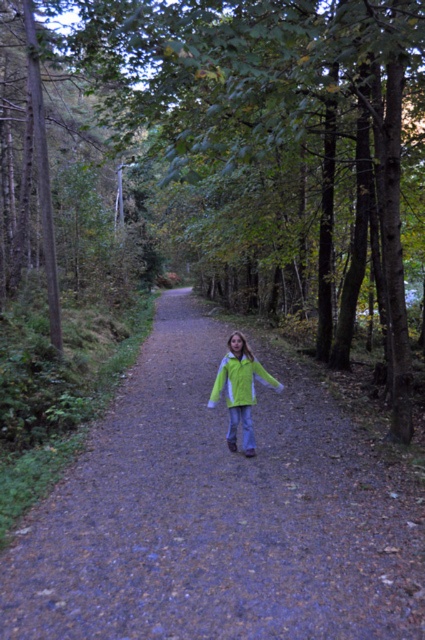
Is green matte jacket at center positioned in front of neon green fabric jacket at center?

Yes, it is.

Is point (254, 387) less distant than point (218, 378)?

No.

Who is more distant from viewer, (234,444) or (223,378)?

Positioned behind is point (234,444).

In order to click on green matte jacket at center in this screenshot , I will do `click(240, 388)`.

Is green fabric jacket at center thinner than neon green fabric jacket at center?

Incorrect, green fabric jacket at center's width is not less than neon green fabric jacket at center's.

Who is more forward, (376, 179) or (218, 392)?

Point (218, 392) is in front.

Is point (340, 144) farther from viewer compared to point (243, 387)?

Yes, point (340, 144) is behind point (243, 387).

Image resolution: width=425 pixels, height=640 pixels. I want to click on green fabric jacket at center, so click(x=246, y=161).

From the picture: Can you confirm if green fabric jacket at center is smaller than green matte jacket at center?

Answer: Actually, green fabric jacket at center might be larger than green matte jacket at center.

Who is positioned more to the right, green fabric jacket at center or green matte jacket at center?

green matte jacket at center is more to the right.

Identify the location of green fabric jacket at center. Image resolution: width=425 pixels, height=640 pixels. (246, 161).